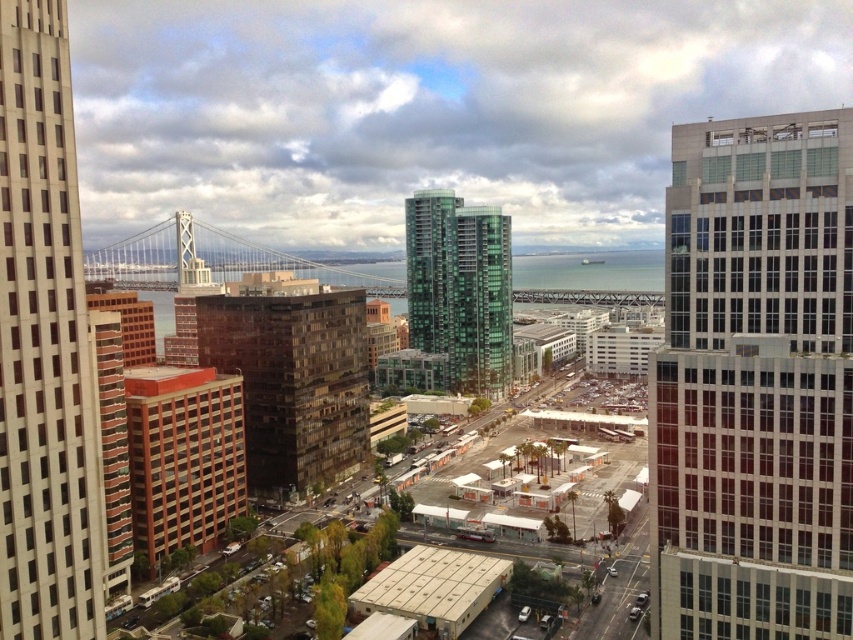
Between glassy reflective skyscraper at right and brick textured building at left, which one appears on the left side from the viewer's perspective?

brick textured building at left

Between glassy reflective skyscraper at right and brick textured building at left, which one is positioned lower?

brick textured building at left is lower down.

Looking at this image, who is more distant from viewer, (705, 588) or (210, 436)?

The point (210, 436) is more distant.

At what (x,y) coordinates should I click in order to perform the action: click on glassy reflective skyscraper at right. Please return your answer as a coordinate pair (x, y). Looking at the image, I should click on (753, 381).

Who is more forward, [165,275] or [103,358]?

Point [103,358] is in front.

Between metallic gray bridge at center-left and brown brick building at lower left, which one is positioned higher?

metallic gray bridge at center-left is above.

Is point (207, 230) positioned in front of point (100, 442)?

No, (207, 230) is behind (100, 442).

At what (x,y) coordinates should I click in order to perform the action: click on metallic gray bridge at center-left. Please return your answer as a coordinate pair (x, y). The width and height of the screenshot is (853, 640). Looking at the image, I should click on (213, 259).

Between brown glass building at center and metallic gray bridge at center-left, which one has less height?

brown glass building at center

Is brown glass building at center closer to camera compared to metallic gray bridge at center-left?

Yes, brown glass building at center is closer to the viewer.

Who is more forward, (x=318, y=403) or (x=381, y=292)?

Positioned in front is point (x=318, y=403).

You are a GUI agent. You are given a task and a screenshot of the screen. Output one action in this format:
    pyautogui.click(x=<x>, y=<y>)
    Task: Click on the brown glass building at center
    
    Given the screenshot: What is the action you would take?
    pyautogui.click(x=293, y=384)